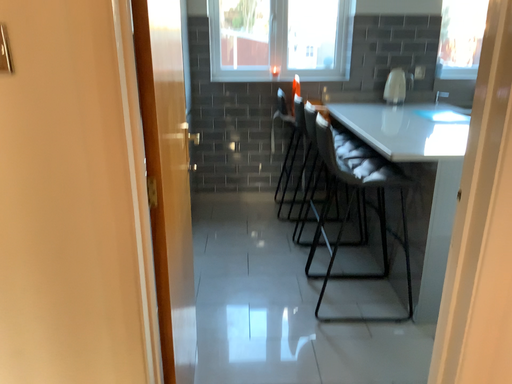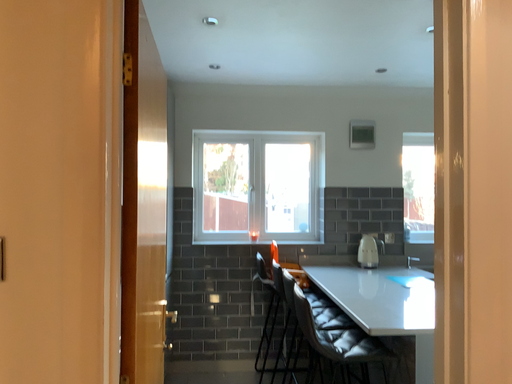
Question: Which way did the camera rotate in the video?

Choices:
 (A) rotated downward
 (B) rotated upward

Answer: (B)